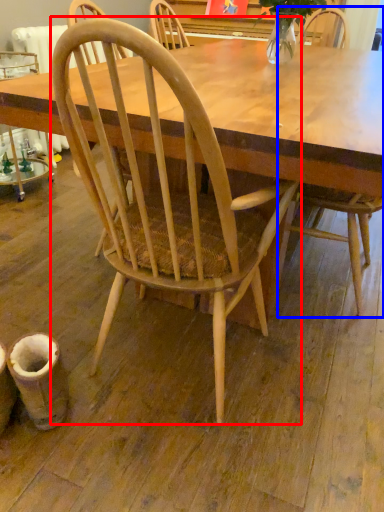
Question: Which object appears closest to the camera in this image, chair (highlighted by a red box) or chair (highlighted by a blue box)?

Choices:
 (A) chair
 (B) chair

Answer: (A)